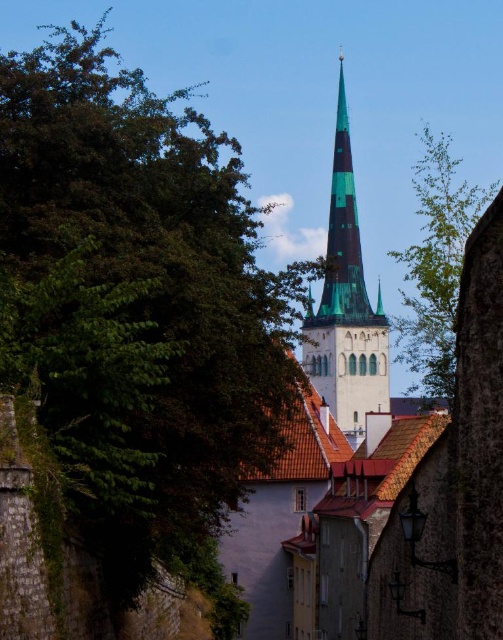
Question: Which object appears closest to the camera in this image?

Choices:
 (A) green glass spire at center
 (B) green leafy tree at upper right

Answer: (A)

Question: Does green glass spire at center appear over green leafy tree at upper right?

Choices:
 (A) no
 (B) yes

Answer: (B)

Question: Is green glass spire at center to the right of green leafy tree at upper right from the viewer's perspective?

Choices:
 (A) yes
 (B) no

Answer: (B)

Question: Does green glass spire at center appear on the right side of green leafy tree at upper right?

Choices:
 (A) yes
 (B) no

Answer: (B)

Question: Among these points, which one is nearest to the camera?

Choices:
 (A) (490, 198)
 (B) (336, 264)

Answer: (B)

Question: Among these points, which one is nearest to the camera?

Choices:
 (A) (338, 364)
 (B) (447, 195)

Answer: (A)